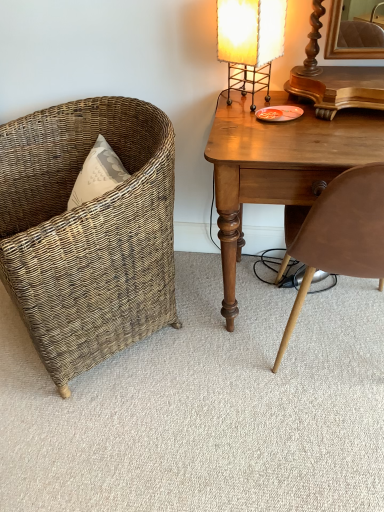
At what (x,y) coordinates should I click in order to perform the action: click on empty space that is in between woven brown chair at left, which is the 2th chair from right to left, and wooden desk at right. Please return your answer as a coordinate pair (x, y). Looking at the image, I should click on (199, 332).